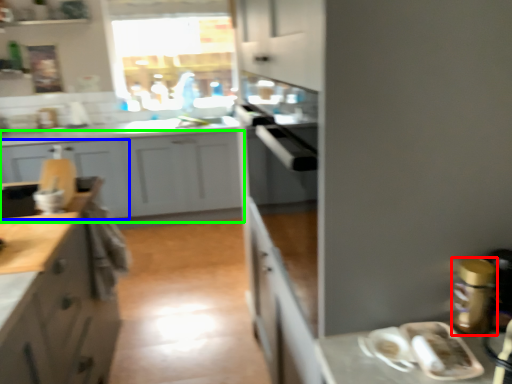
Question: Estimate the real-world distances between objects in this image. Which object is closer to appliance (highlighted by a red box), cabinetry (highlighted by a blue box) or cabinetry (highlighted by a green box)?

Choices:
 (A) cabinetry
 (B) cabinetry

Answer: (B)